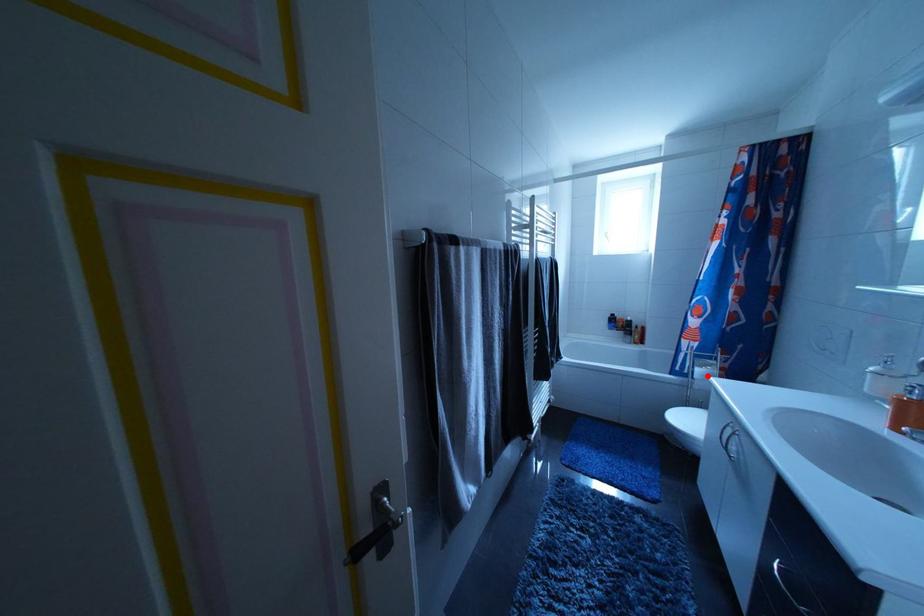
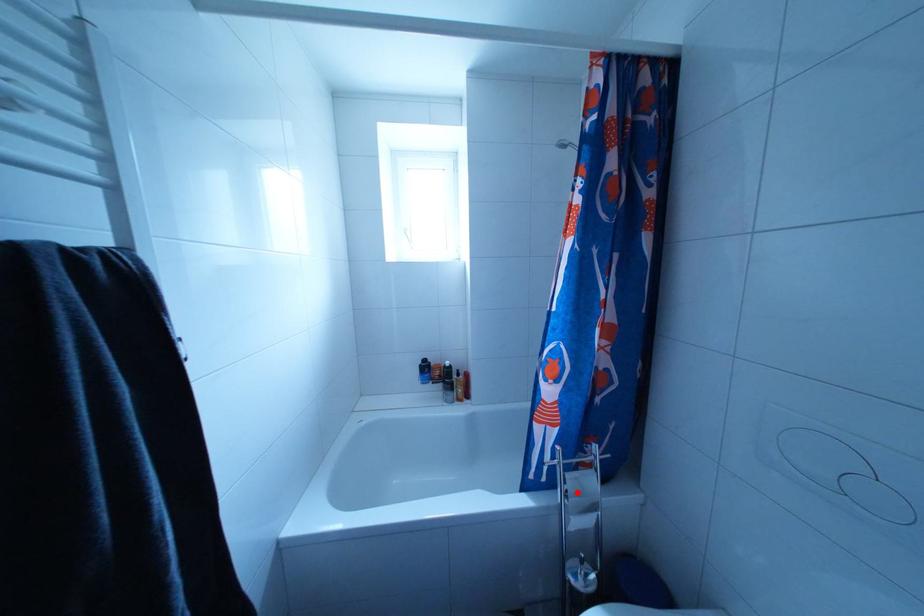
I am providing you with two images of the same scene from different viewpoints. A red point is marked on the first image and another point is marked on the second image. Is the marked point in image1 the same physical position as the marked point in image2?

Yes